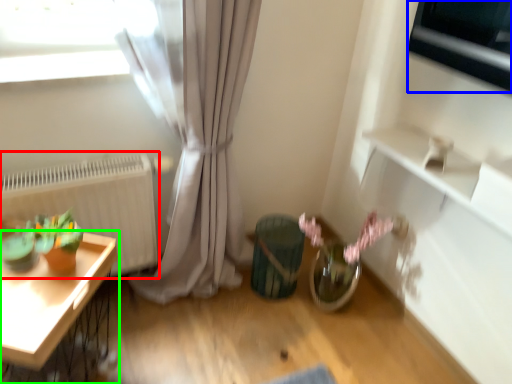
Question: Based on their relative distances, which object is nearer to radiator (highlighted by a red box)? Choose from appliance (highlighted by a blue box) and table (highlighted by a green box).

Choices:
 (A) appliance
 (B) table

Answer: (B)